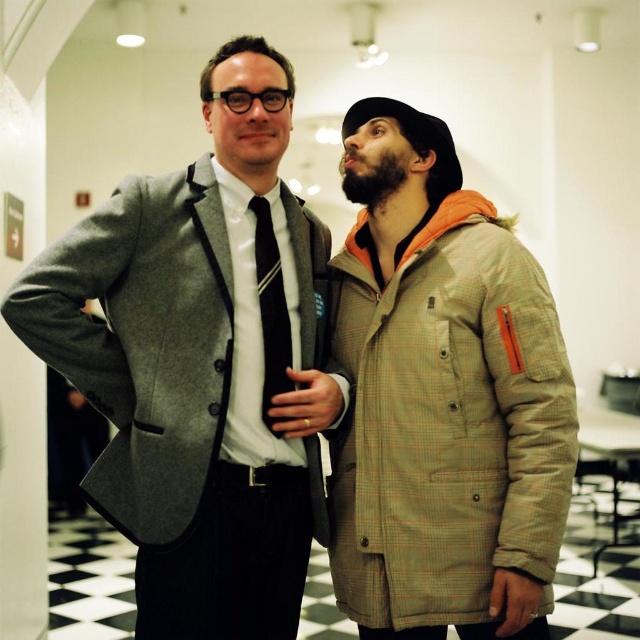
Question: Does matte gray blazer at center lie in front of black silk tie at center?

Choices:
 (A) yes
 (B) no

Answer: (A)

Question: Is matte gray blazer at center smaller than plaid wool jacket at right?

Choices:
 (A) yes
 (B) no

Answer: (B)

Question: Can you confirm if matte gray blazer at center is positioned to the right of plaid wool jacket at right?

Choices:
 (A) yes
 (B) no

Answer: (B)

Question: Which point is closer to the camera taking this photo?

Choices:
 (A) (260, 266)
 (B) (273, 625)

Answer: (A)

Question: Which of the following is the farthest from the observer?

Choices:
 (A) plaid wool jacket at right
 (B) matte gray blazer at center
 (C) black silk tie at center

Answer: (C)

Question: Which of these objects is positioned farthest from the black silk tie at center?

Choices:
 (A) plaid wool jacket at right
 (B) matte gray blazer at center

Answer: (A)